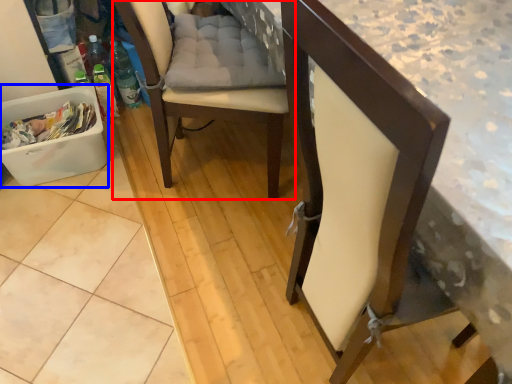
Question: Which of the following is the farthest to the observer, chair (highlighted by a red box) or laundry basket (highlighted by a blue box)?

Choices:
 (A) chair
 (B) laundry basket

Answer: (B)